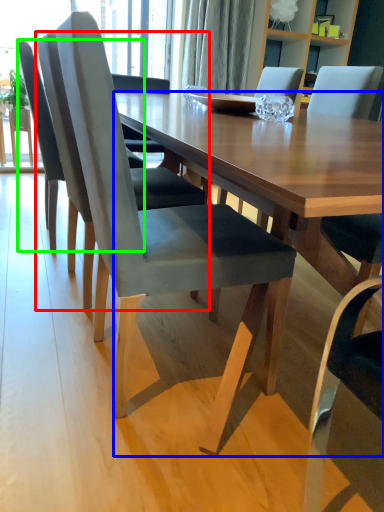
Question: Estimate the real-world distances between objects in this image. Which object is farther from chair (highlighted by a red box), desk (highlighted by a blue box) or chair (highlighted by a green box)?

Choices:
 (A) desk
 (B) chair

Answer: (A)